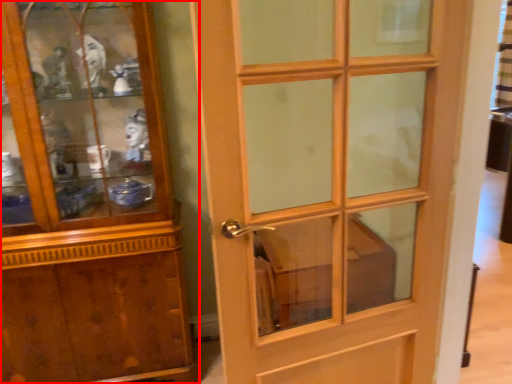
Question: Observing the image, what is the correct spatial positioning of cupboard (annotated by the red box) in reference to door?

Choices:
 (A) right
 (B) left

Answer: (B)